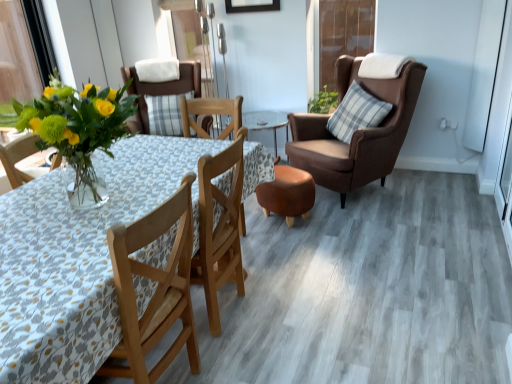
Question: Is brown leather chair at right, which ranks as the second chair in left-to-right order, oriented towards transparent plastic screen door at upper center?

Choices:
 (A) no
 (B) yes

Answer: (A)

Question: Does brown leather chair at right, placed as the first chair when sorted from right to left, have a greater height compared to transparent plastic screen door at upper center?

Choices:
 (A) no
 (B) yes

Answer: (B)

Question: Is brown leather chair at right, which ranks as the second chair in left-to-right order, positioned far away from transparent plastic screen door at upper center?

Choices:
 (A) no
 (B) yes

Answer: (A)

Question: Could transparent plastic screen door at upper center be considered to be inside brown leather chair at right, placed as the first chair when sorted from right to left?

Choices:
 (A) no
 (B) yes

Answer: (A)

Question: From the image's perspective, is brown leather chair at right, which ranks as the second chair in left-to-right order, beneath transparent plastic screen door at upper center?

Choices:
 (A) yes
 (B) no

Answer: (A)

Question: Is brown leather chair at right, placed as the first chair when sorted from right to left, at the left side of transparent plastic screen door at upper center?

Choices:
 (A) no
 (B) yes

Answer: (B)

Question: From a real-world perspective, is wooden floral-patterned table at center over matte glass vase with yellow flowers at left?

Choices:
 (A) no
 (B) yes

Answer: (A)

Question: Considering the relative positions of wooden floral-patterned table at center and matte glass vase with yellow flowers at left in the image provided, is wooden floral-patterned table at center to the right of matte glass vase with yellow flowers at left from the viewer's perspective?

Choices:
 (A) yes
 (B) no

Answer: (A)

Question: From the image's perspective, is wooden floral-patterned table at center over matte glass vase with yellow flowers at left?

Choices:
 (A) no
 (B) yes

Answer: (A)

Question: Does wooden floral-patterned table at center have a smaller size compared to matte glass vase with yellow flowers at left?

Choices:
 (A) no
 (B) yes

Answer: (A)

Question: Does wooden floral-patterned table at center have a greater width compared to matte glass vase with yellow flowers at left?

Choices:
 (A) yes
 (B) no

Answer: (A)

Question: Does wooden floral-patterned table at center appear on the left side of matte glass vase with yellow flowers at left?

Choices:
 (A) no
 (B) yes

Answer: (A)

Question: Does matte glass vase with yellow flowers at left come behind matte brown chair at center, which is counted as the first chair, starting from the left?

Choices:
 (A) no
 (B) yes

Answer: (A)